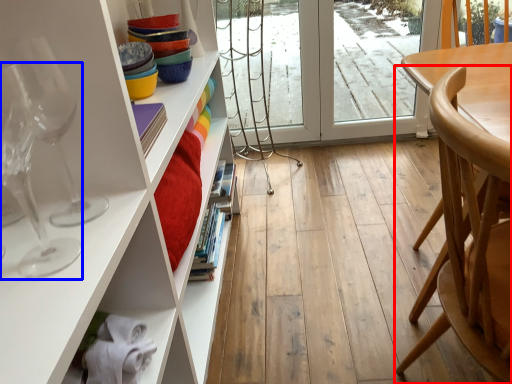
Question: Among these objects, which one is farthest to the camera, chair (highlighted by a red box) or wine glass (highlighted by a blue box)?

Choices:
 (A) chair
 (B) wine glass

Answer: (A)